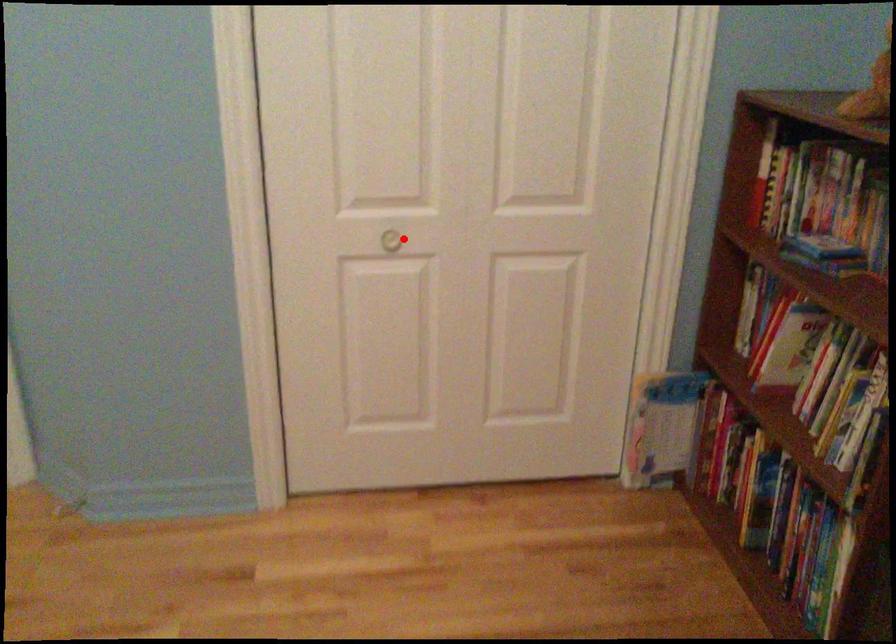
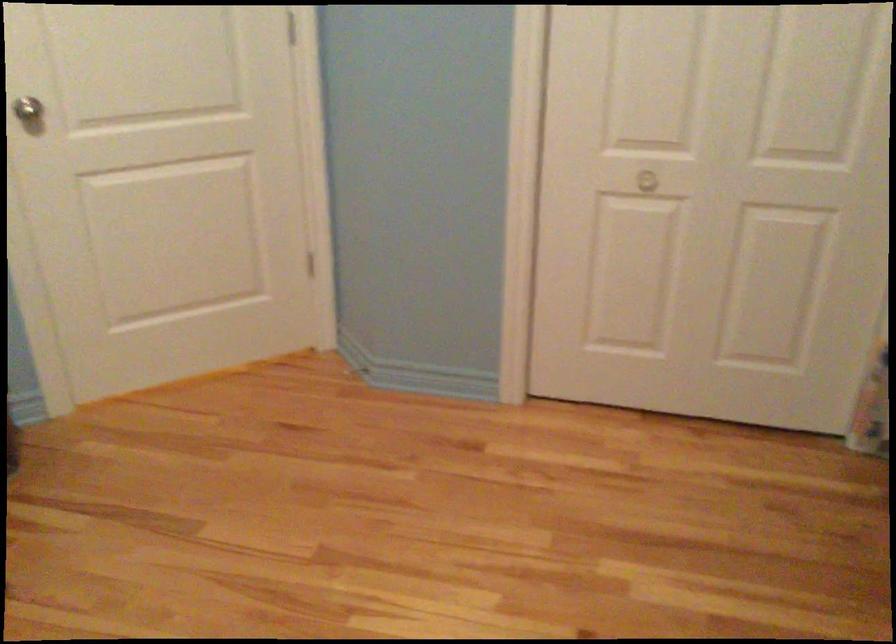
Question: I am providing you with two images of the same scene from different viewpoints. A red point is marked on the first image. Is the red point's position out of view in image 2?

Choices:
 (A) Yes
 (B) No

Answer: (B)